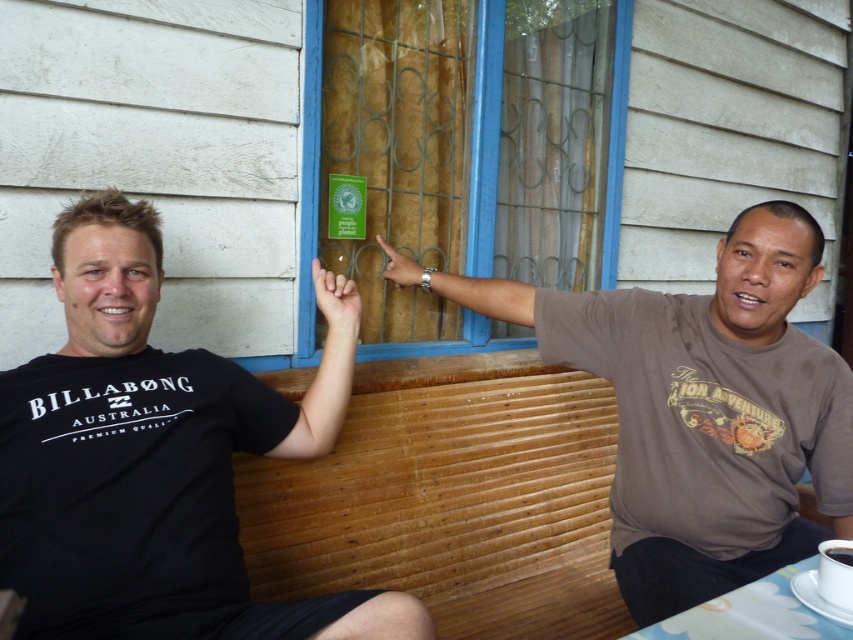
Measure the distance from black t-shirt at left to green matte sign at upper center.

The distance of black t-shirt at left from green matte sign at upper center is 30.67 inches.

The height and width of the screenshot is (640, 853). Describe the element at coordinates (152, 464) in the screenshot. I see `black t-shirt at left` at that location.

Image resolution: width=853 pixels, height=640 pixels. Identify the location of black t-shirt at left. (152, 464).

Which is above, black t-shirt at left or brown cotton shirt at center?

brown cotton shirt at center is higher up.

Who is more forward, (141, 429) or (831, 509)?

Positioned in front is point (141, 429).

The height and width of the screenshot is (640, 853). In order to click on black t-shirt at left in this screenshot , I will do `click(152, 464)`.

Is the position of black t-shirt at left more distant than that of white plastic table at lower right?

Yes, black t-shirt at left is further from the viewer.

Which of these two, black t-shirt at left or white plastic table at lower right, stands taller?

With more height is black t-shirt at left.

Between point (245, 625) and point (689, 636), which one is positioned in front?

Point (689, 636) is more forward.

This screenshot has height=640, width=853. In order to click on black t-shirt at left in this screenshot , I will do `click(152, 464)`.